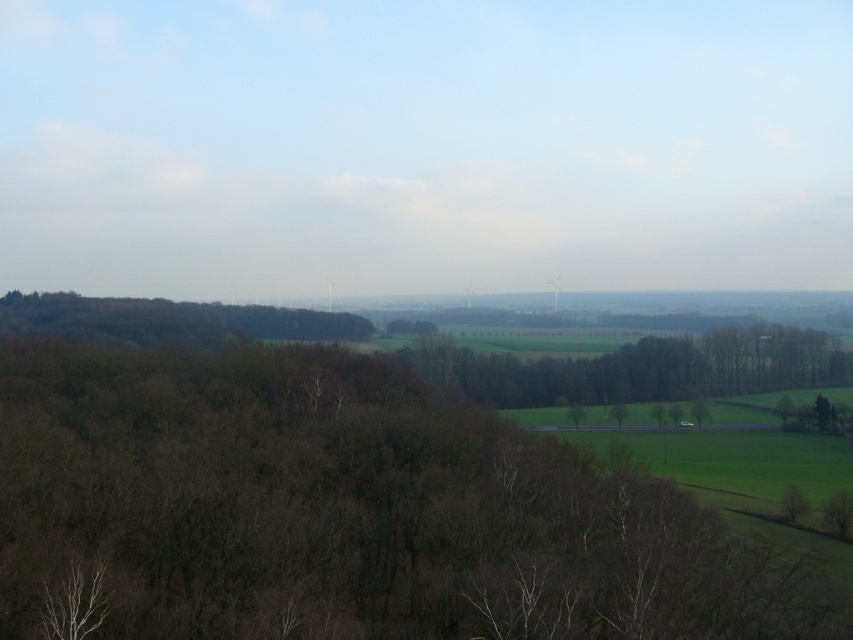
Question: In this image, where is brown leafless tree at lower left located relative to green leafy trees at center?

Choices:
 (A) right
 (B) left

Answer: (B)

Question: Which point appears closest to the camera in this image?

Choices:
 (A) (320, 337)
 (B) (460, 512)
 (C) (427, 339)

Answer: (B)

Question: Does brown leafless tree at lower left come behind dark brown textured trees at left?

Choices:
 (A) yes
 (B) no

Answer: (B)

Question: Which object is positioned farthest from the brown leafless tree at lower left?

Choices:
 (A) dark brown textured trees at left
 (B) green leafy trees at center

Answer: (B)

Question: Is brown leafless tree at lower left wider than green leafy trees at center?

Choices:
 (A) no
 (B) yes

Answer: (B)

Question: Estimate the real-world distances between objects in this image. Which object is closer to the green leafy trees at center?

Choices:
 (A) brown leafless tree at lower left
 (B) dark brown textured trees at left

Answer: (B)